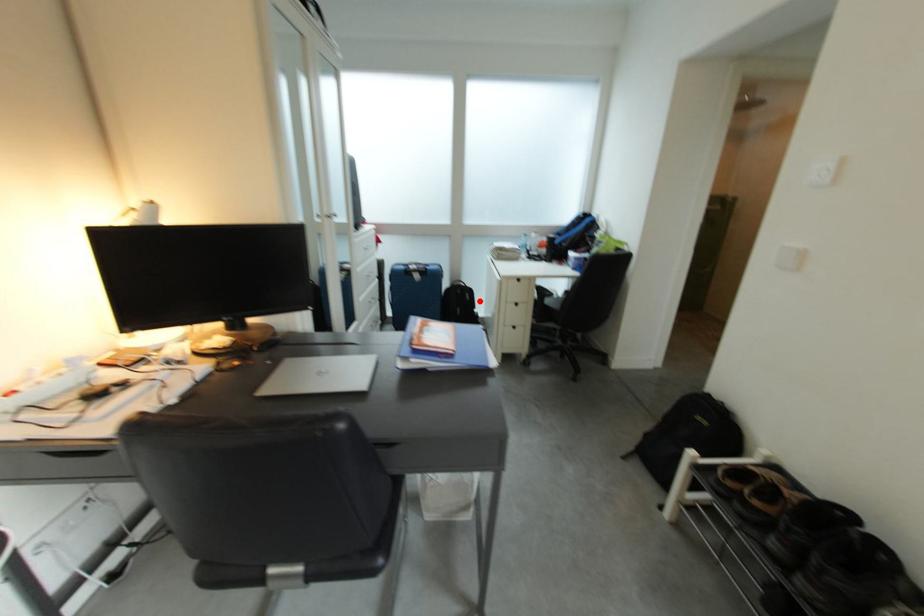
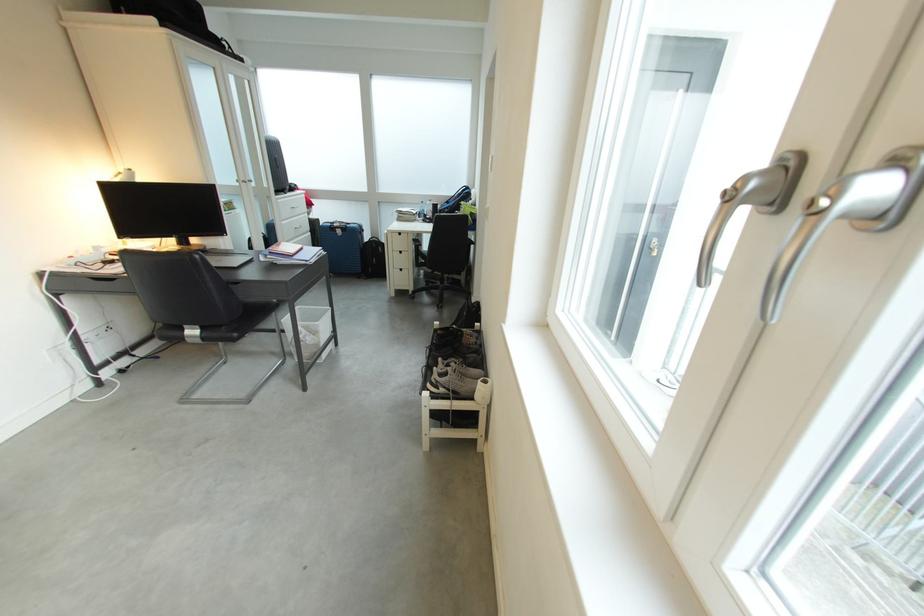
The point at the highlighted location is marked in the first image. Where is the corresponding point in the second image?

(392, 254)